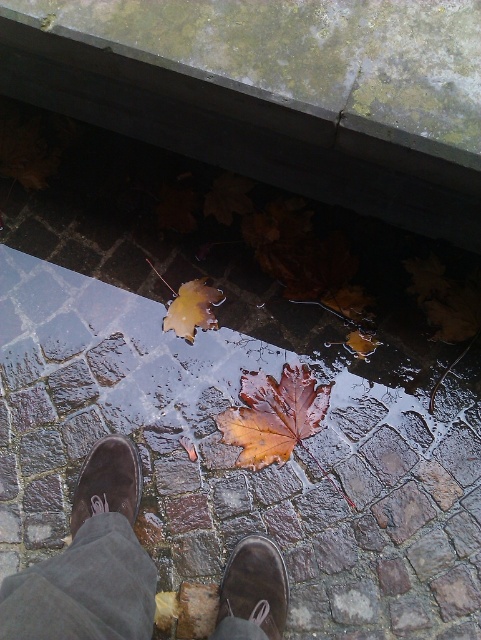
Question: Is brown suede shoe at lower center below yellow matte maple leaf at center?

Choices:
 (A) yes
 (B) no

Answer: (A)

Question: Which object is the farthest from the brown suede shoe at lower left?

Choices:
 (A) brown matte leaf at center
 (B) yellow matte maple leaf at center
 (C) brown suede shoe at lower center
 (D) brown suede shoes at center

Answer: (B)

Question: Is wet stone pavement at center positioned before brown matte leaf at center?

Choices:
 (A) no
 (B) yes

Answer: (B)

Question: Based on their relative distances, which object is farther from the brown suede shoe at lower left?

Choices:
 (A) brown suede shoes at center
 (B) brown matte leaf at center
 (C) brown suede shoe at lower center

Answer: (C)

Question: Is wet stone pavement at center bigger than brown suede shoe at lower left?

Choices:
 (A) no
 (B) yes

Answer: (B)

Question: Which point is closer to the camera?

Choices:
 (A) (166, 314)
 (B) (126, 442)

Answer: (B)